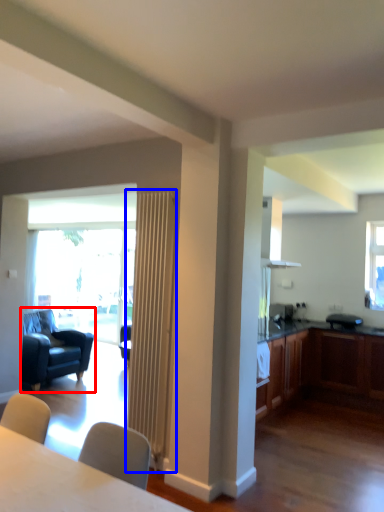
Question: Which point is closer to the camera, chair (highlighted by a red box) or radiator (highlighted by a blue box)?

Choices:
 (A) chair
 (B) radiator

Answer: (B)